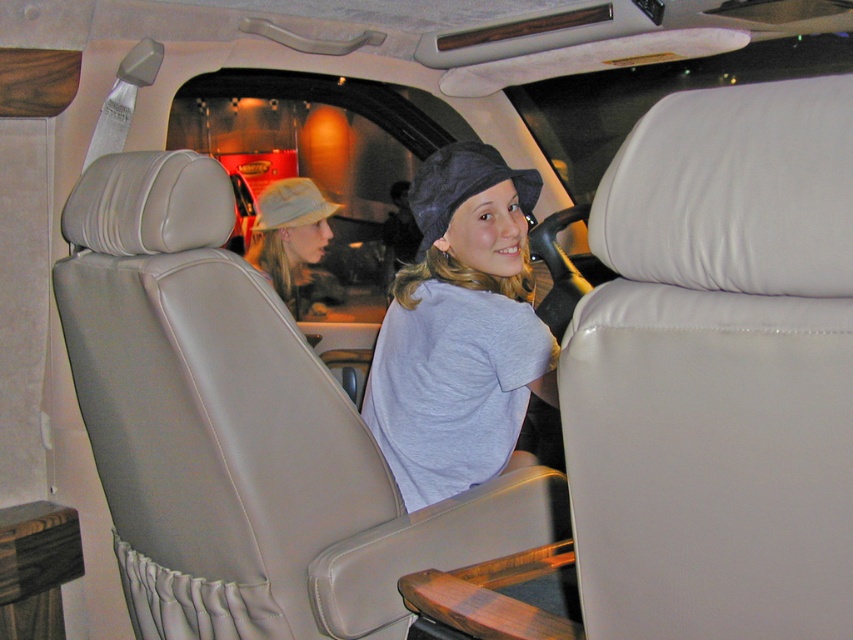
You are sitting in the backseat of the vehicle and want to hand a small item to the person wearing the matte beige hat at center. Based on the coordinates provided, which direction should you lean to reach them?

The matte beige hat at center is located at coordinates point (289,232). Since the driver is on the left side of the frame and the passenger on the right, the coordinates suggest the hat is closer to the driver. Therefore, you should lean to the left to reach the person wearing the matte beige hat at center.

You are a passenger in the backseat of this vehicle and need to hand a small item to the driver. The driver is wearing a dark blue fabric baseball hat at center and has a light gray cotton shirt at center. Which item of clothing is wider so you can aim your throw more accurately?

The light gray cotton shirt at center is wider than the dark blue fabric baseball hat at center, so aim for the shirt to ensure accuracy.

You are a delivery robot with a package that needs to be placed between the light gray cotton shirt at center and the khaki fabric baseball hat at center. The package is 4 feet long. Can you fit the package between them?

The light gray cotton shirt at center is 3.94 feet away from the khaki fabric baseball hat at center. Since the package is 4 feet long, it is slightly longer than the distance between them, so the package cannot fit between the light gray cotton shirt at center and the khaki fabric baseball hat at center.